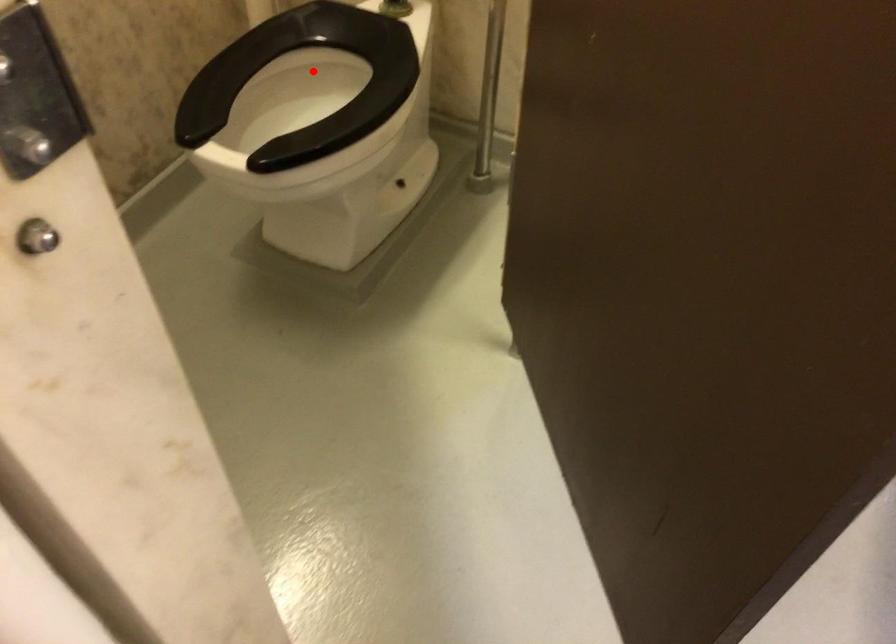
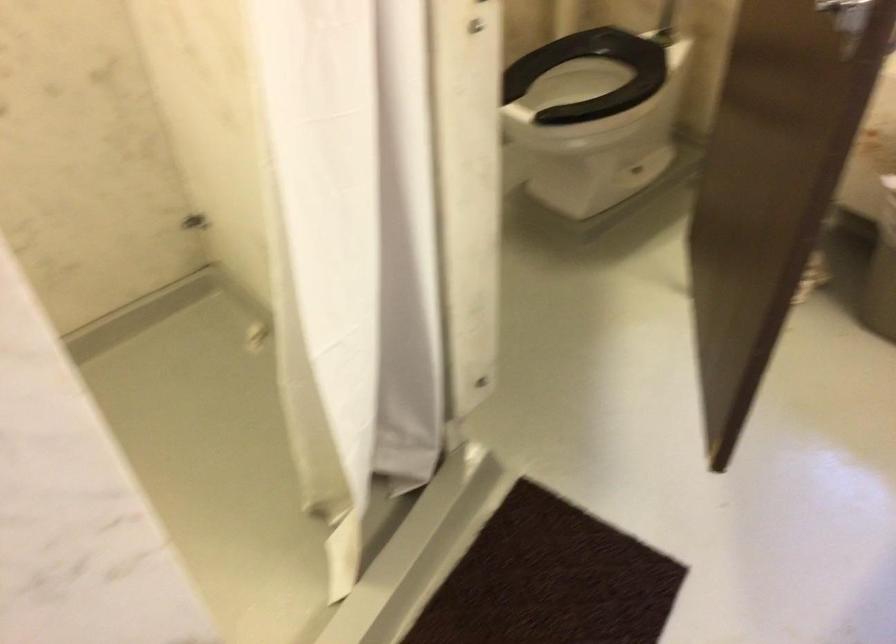
Where in the second image is the point corresponding to the highlighted location from the first image?

(591, 75)